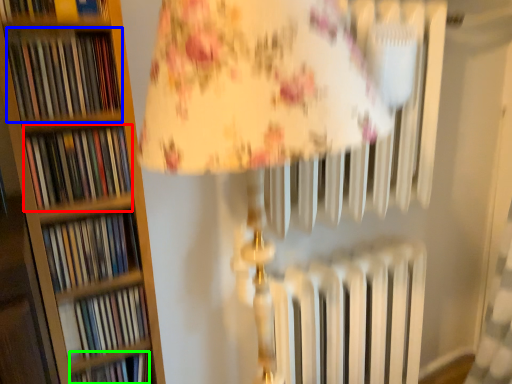
Question: Considering the real-world distances, which object is closest to book (highlighted by a red box)? book (highlighted by a blue box) or book (highlighted by a green box).

Choices:
 (A) book
 (B) book

Answer: (A)